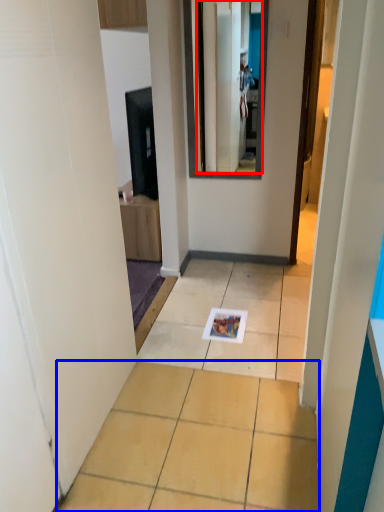
Question: Which object appears closest to the camera in this image, mirror (highlighted by a red box) or ceramic tile (highlighted by a blue box)?

Choices:
 (A) mirror
 (B) ceramic tile

Answer: (B)